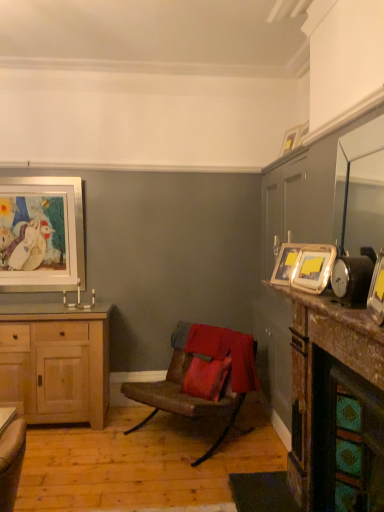
Question: Can you confirm if metallic silver alarm clock at right is positioned to the right of marble countertop at right, which is the 2th counter top from bottom to top?

Choices:
 (A) no
 (B) yes

Answer: (B)

Question: Is there a large distance between metallic silver alarm clock at right and marble countertop at right, the first counter top when ordered from top to bottom?

Choices:
 (A) no
 (B) yes

Answer: (A)

Question: Is metallic silver alarm clock at right further to the viewer compared to marble countertop at right, the first counter top when ordered from top to bottom?

Choices:
 (A) yes
 (B) no

Answer: (A)

Question: Does metallic silver alarm clock at right have a smaller size compared to marble countertop at right, the first counter top when ordered from top to bottom?

Choices:
 (A) yes
 (B) no

Answer: (A)

Question: From the image's perspective, does metallic silver alarm clock at right appear lower than marble countertop at right, the first counter top when ordered from top to bottom?

Choices:
 (A) no
 (B) yes

Answer: (A)

Question: Does metallic silver alarm clock at right appear on the left side of marble countertop at right, which is the 2th counter top from bottom to top?

Choices:
 (A) no
 (B) yes

Answer: (A)

Question: Does brown leather chair at center have a larger size compared to metallic gold picture frame at right, acting as the 2th picture frame starting from the right?

Choices:
 (A) no
 (B) yes

Answer: (B)

Question: From a real-world perspective, is brown leather chair at center positioned under metallic gold picture frame at right, placed as the fifth picture frame when sorted from back to front, based on gravity?

Choices:
 (A) no
 (B) yes

Answer: (B)

Question: Would you say brown leather chair at center contains metallic gold picture frame at right, placed as the fifth picture frame when sorted from back to front?

Choices:
 (A) no
 (B) yes

Answer: (A)

Question: Is brown leather chair at center not within metallic gold picture frame at right, which appears as the fourth picture frame when viewed from the left?

Choices:
 (A) no
 (B) yes

Answer: (B)

Question: Is brown leather chair at center aimed at metallic gold picture frame at right, placed as the fifth picture frame when sorted from back to front?

Choices:
 (A) yes
 (B) no

Answer: (B)

Question: From a real-world perspective, is brown leather chair at center on top of metallic gold picture frame at right, placed as the fifth picture frame when sorted from back to front?

Choices:
 (A) yes
 (B) no

Answer: (B)

Question: From the image's perspective, does marble fireplace at right, acting as the 1th counter top starting from the bottom, appear lower than light wood cabinet at left?

Choices:
 (A) yes
 (B) no

Answer: (B)